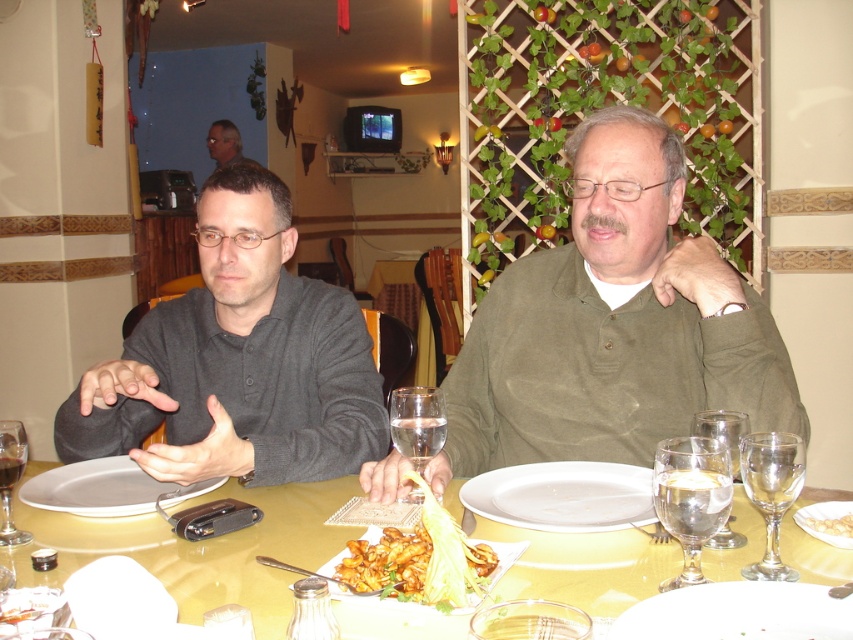
The image size is (853, 640). What do you see at coordinates (612, 324) in the screenshot?
I see `green matte shirt at center` at bounding box center [612, 324].

This screenshot has height=640, width=853. I want to click on green matte shirt at center, so click(x=612, y=324).

Where is `green matte shirt at center`? green matte shirt at center is located at coordinates (612, 324).

Is point (593, 612) closer to viewer compared to point (474, 586)?

That is True.

Who is higher up, yellow matte table at center or golden crispy shrimp at center?

Positioned higher is golden crispy shrimp at center.

Which is in front, point (843, 572) or point (465, 545)?

Point (465, 545) is more forward.

Locate an element on the screen. This screenshot has height=640, width=853. yellow matte table at center is located at coordinates (202, 548).

Does dark gray shirt at left appear on the right side of clear glass wine glass at lower right?

In fact, dark gray shirt at left is to the left of clear glass wine glass at lower right.

Does dark gray shirt at left appear on the left side of clear glass wine glass at lower right?

Indeed, dark gray shirt at left is positioned on the left side of clear glass wine glass at lower right.

What do you see at coordinates (238, 360) in the screenshot?
I see `dark gray shirt at left` at bounding box center [238, 360].

Identify the location of dark gray shirt at left. This screenshot has height=640, width=853. click(238, 360).